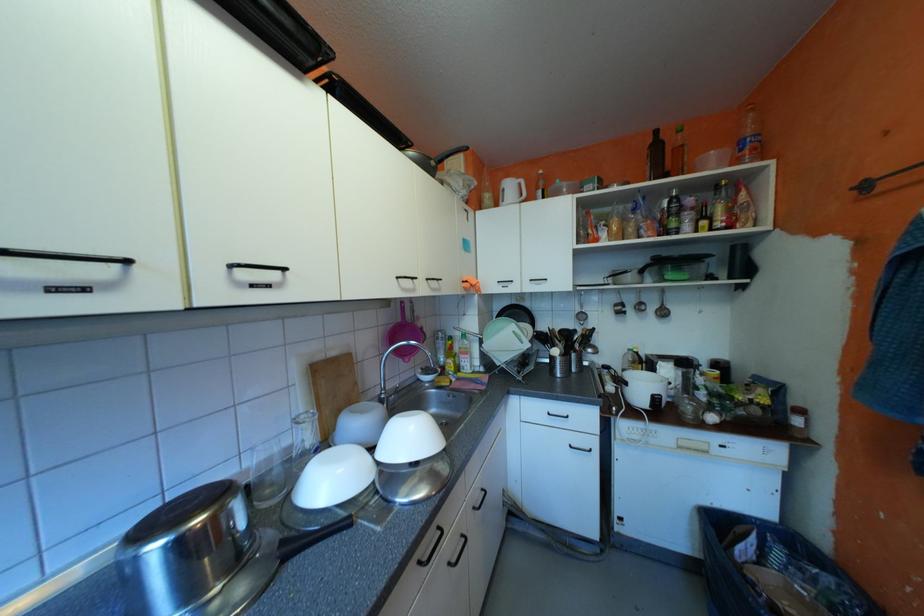
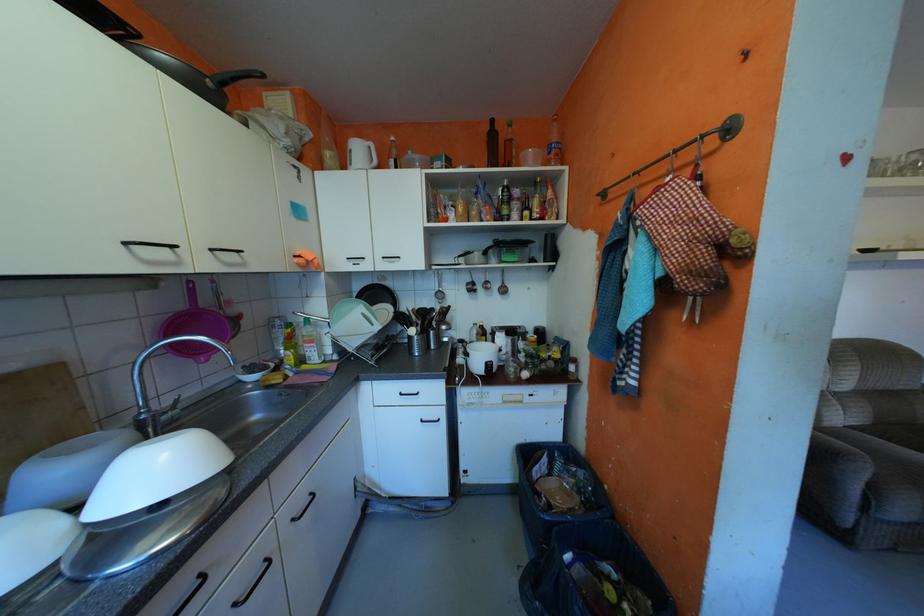
Question: In a continuous first-person perspective shot, in which direction is the camera moving?

Choices:
 (A) Left
 (B) Right
 (C) Forward
 (D) Backward

Answer: (B)